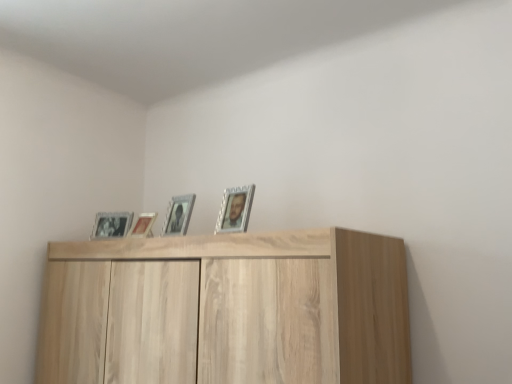
Question: From the image's perspective, would you say metallic silver picture frame at center, the 2th picture frame viewed from the right, is shown under light wood cupboard at upper center?

Choices:
 (A) yes
 (B) no

Answer: (B)

Question: From a real-world perspective, is metallic silver picture frame at center, arranged as the third picture frame when viewed from the left, under light wood cupboard at upper center?

Choices:
 (A) no
 (B) yes

Answer: (A)

Question: Is light wood cupboard at upper center completely or partially inside metallic silver picture frame at center, which is counted as the 2th picture frame, starting from the front?

Choices:
 (A) yes
 (B) no

Answer: (B)

Question: Can you confirm if metallic silver picture frame at center, the 2th picture frame viewed from the right, is positioned to the right of light wood cupboard at upper center?

Choices:
 (A) no
 (B) yes

Answer: (A)

Question: Considering the relative sizes of metallic silver picture frame at center, the 2th picture frame viewed from the right, and light wood cupboard at upper center in the image provided, is metallic silver picture frame at center, the 2th picture frame viewed from the right, thinner than light wood cupboard at upper center?

Choices:
 (A) no
 (B) yes

Answer: (B)

Question: Based on their sizes in the image, would you say light wood cupboard at upper center is bigger or smaller than metallic silver photo frame at upper left, which ranks as the 4th picture frame in front-to-back order?

Choices:
 (A) small
 (B) big

Answer: (B)

Question: From a real-world perspective, is light wood cupboard at upper center physically located above or below metallic silver photo frame at upper left, which ranks as the 4th picture frame in front-to-back order?

Choices:
 (A) above
 (B) below

Answer: (B)

Question: In terms of height, does light wood cupboard at upper center look taller or shorter compared to metallic silver photo frame at upper left, the fourth picture frame when ordered from right to left?

Choices:
 (A) short
 (B) tall

Answer: (B)

Question: Is light wood cupboard at upper center in front of or behind metallic silver photo frame at upper left, the fourth picture frame when ordered from right to left, in the image?

Choices:
 (A) front
 (B) behind

Answer: (A)

Question: Visually, is metallic silver photo frame at upper left, which appears as the 1th picture frame when viewed from the back, positioned to the left or to the right of light wood cupboard at upper center?

Choices:
 (A) right
 (B) left

Answer: (B)

Question: From their relative heights in the image, would you say metallic silver photo frame at upper left, the fourth picture frame when ordered from right to left, is taller or shorter than light wood cupboard at upper center?

Choices:
 (A) tall
 (B) short

Answer: (B)

Question: Looking at the image, does metallic silver photo frame at upper left, which ranks as the 4th picture frame in front-to-back order, seem bigger or smaller compared to light wood cupboard at upper center?

Choices:
 (A) big
 (B) small

Answer: (B)

Question: Considering the positions of metallic silver photo frame at upper left, the fourth picture frame when ordered from right to left, and light wood cupboard at upper center in the image, is metallic silver photo frame at upper left, the fourth picture frame when ordered from right to left, wider or thinner than light wood cupboard at upper center?

Choices:
 (A) thin
 (B) wide

Answer: (A)

Question: From the image's perspective, is metallic silver photo frame at upper left, the fourth picture frame when ordered from right to left, located above or below metallic silver picture frame at center, arranged as the third picture frame when viewed from the left?

Choices:
 (A) below
 (B) above

Answer: (A)

Question: Considering the positions of metallic silver photo frame at upper left, which ranks as the 4th picture frame in front-to-back order, and metallic silver picture frame at center, which is counted as the 2th picture frame, starting from the front, in the image, is metallic silver photo frame at upper left, which ranks as the 4th picture frame in front-to-back order, bigger or smaller than metallic silver picture frame at center, which is counted as the 2th picture frame, starting from the front,?

Choices:
 (A) small
 (B) big

Answer: (B)